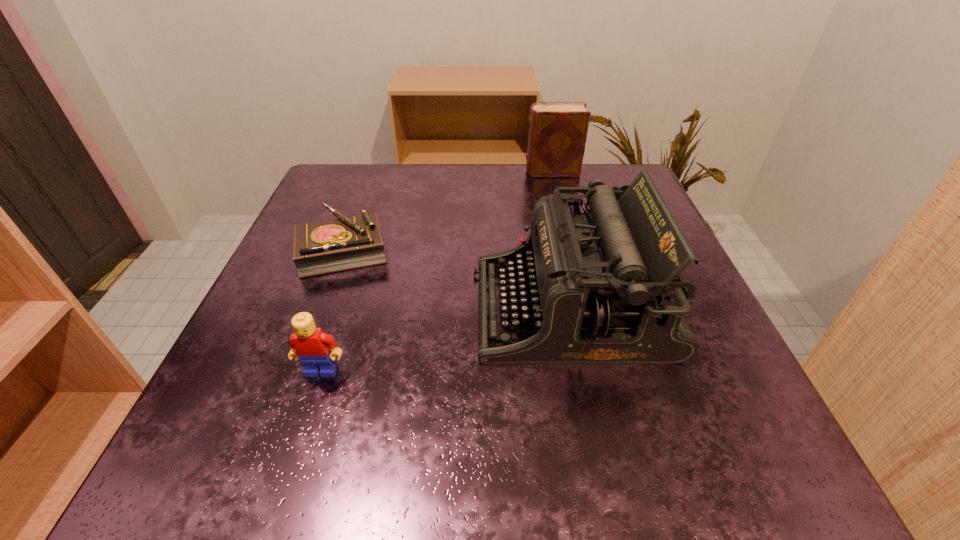
Identify the location of vacant space located on the spine side of the farthest object. (436, 171).

Locate an element on the screen. This screenshot has height=540, width=960. vacant space located 0.400m on the spine side of the farthest object is located at coordinates (363, 171).

At what (x,y) coordinates should I click in order to perform the action: click on vacant region located 0.060m on the face of the Lego. Please return your answer as a coordinate pair (x, y). The image size is (960, 540). Looking at the image, I should click on (307, 416).

Identify the location of free point located on the front of the nearer diary. The width and height of the screenshot is (960, 540). (275, 434).

Locate an element on the screen. The height and width of the screenshot is (540, 960). object present at the far edge is located at coordinates (557, 135).

This screenshot has width=960, height=540. In order to click on Lego at the left edge in this screenshot , I will do `click(310, 344)`.

This screenshot has width=960, height=540. In order to click on diary that is positioned at the left edge in this screenshot , I will do `click(346, 243)`.

Where is `typewriter located in the right edge section of the desktop`? This screenshot has width=960, height=540. typewriter located in the right edge section of the desktop is located at coordinates (605, 286).

Where is `diary situated at the right edge`? diary situated at the right edge is located at coordinates (557, 135).

I want to click on object located at the far right corner, so click(557, 135).